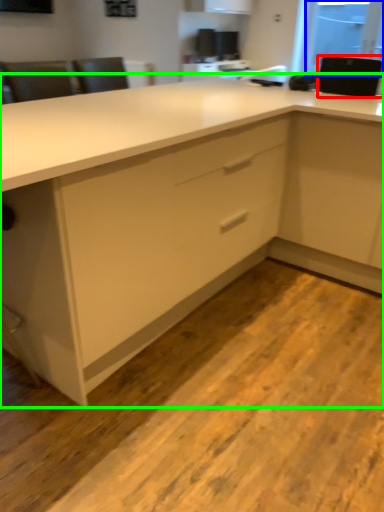
Question: Estimate the real-world distances between objects in this image. Which object is closer to appliance (highlighted by a red box), window screen (highlighted by a blue box) or cabinetry (highlighted by a green box)?

Choices:
 (A) window screen
 (B) cabinetry

Answer: (B)